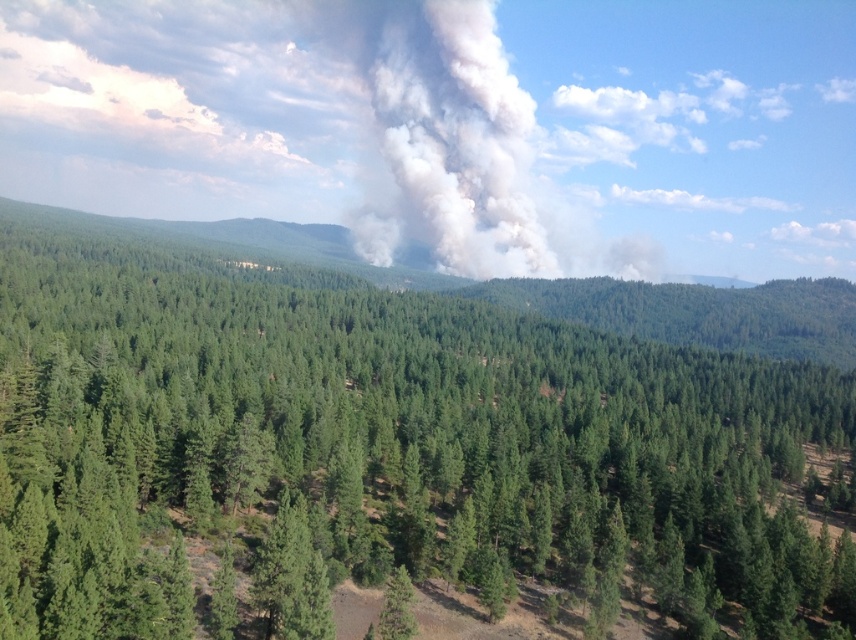
You are a firefighter navigating through a dense forest. You see a point marked at coordinates (x=390, y=452). What object is located at that point?

The point at coordinates (x=390, y=452) indicates a green matte tree at center.

You are a drone operator tasked with monitoring the wildfire in the forest. You have two coordinates to inspect, point 1 at point (452, 515) and point 2 at point (393, 630). Which point is closer to the camera?

Point (393, 630) is closer to the camera because it is less further than point (452, 515).

You are a hiker who has just entered the forest and wants to find the tallest tree to take a photo. You see two trees in your path, the green matte tree at center and the green matte tree at lower center. Which tree should you choose?

The green matte tree at center is bigger than the green matte tree at lower center, so you should choose the green matte tree at center for your photo.